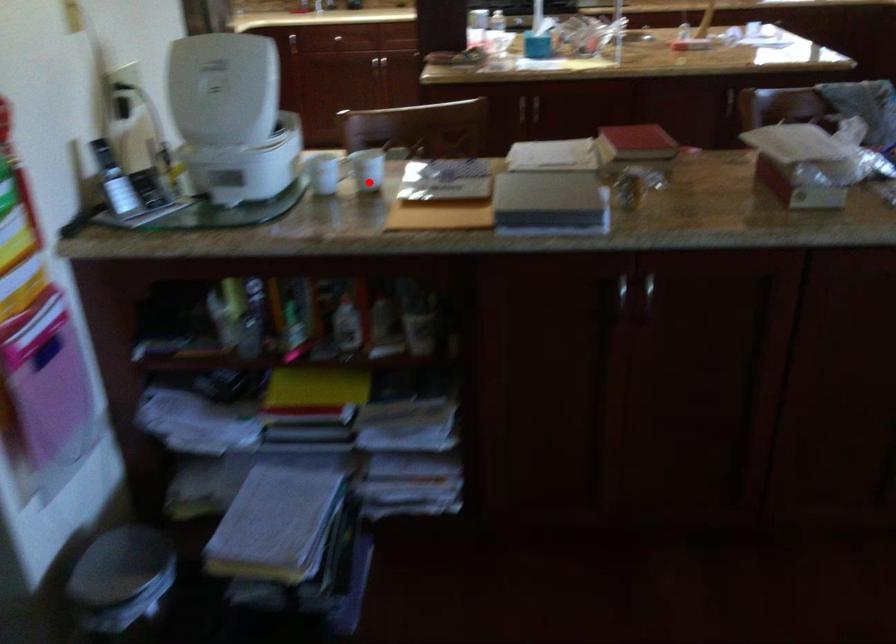
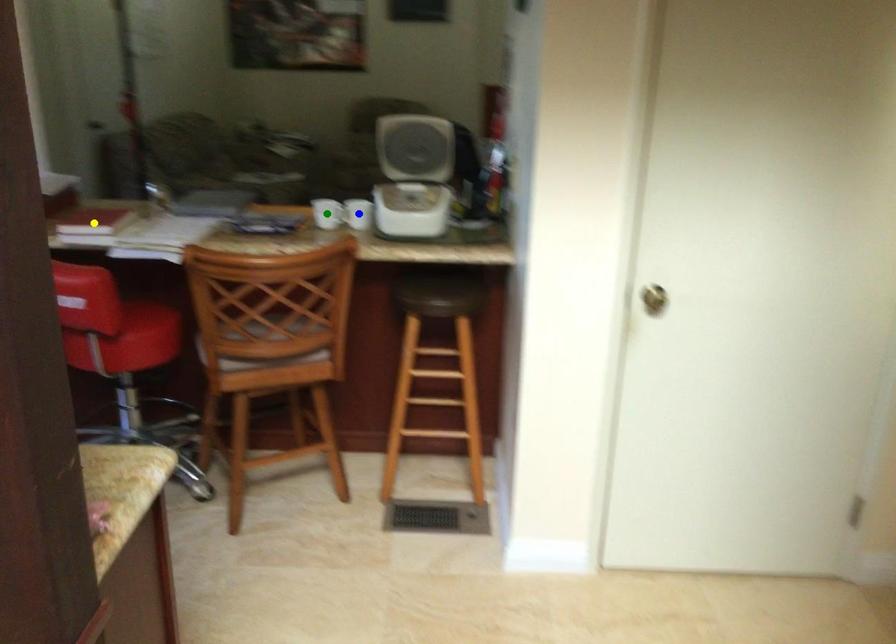
Question: I am providing you with two images of the same scene from different viewpoints. A red point is marked on the first image. You are given multiple points on the second image. Which point in image 2 is actually the same real-world point as the red point in image 1?

Choices:
 (A) blue point
 (B) green point
 (C) yellow point

Answer: (B)